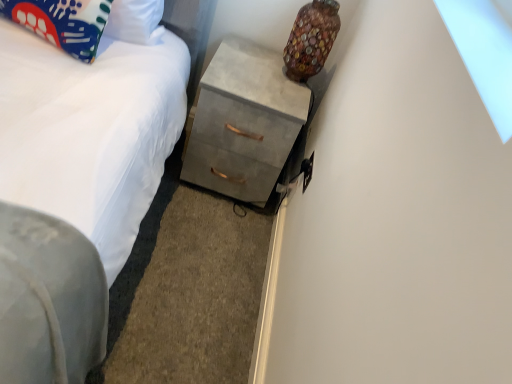
Locate an element on the screen. The image size is (512, 384). vacant space to the left of multicolored glass vase at upper right is located at coordinates (248, 59).